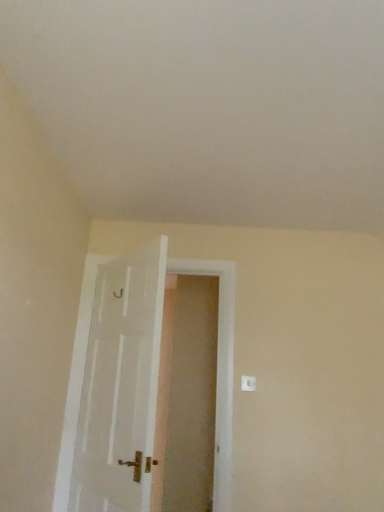
Identify the location of white painted wood door at center. 134,380.

Describe the element at coordinates (134, 380) in the screenshot. I see `white painted wood door at center` at that location.

In the scene shown: Measure the distance between point (132, 445) and camera.

They are 1.80 meters apart.

This screenshot has height=512, width=384. Identify the location of white painted wood door at center. (134, 380).